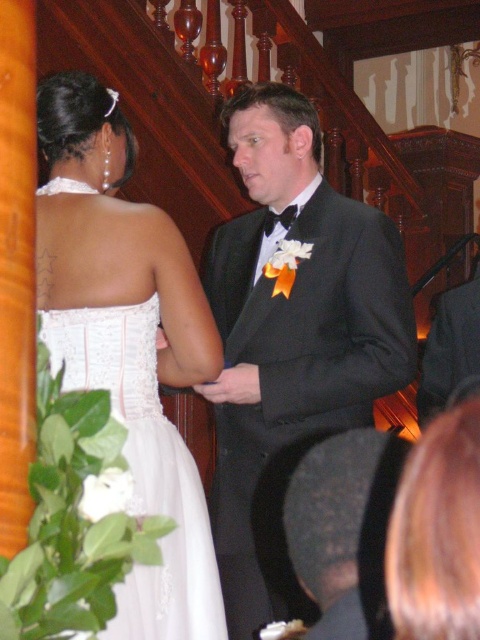
You are a photographer at a wedding. You need to capture a closeup shot of the black satin tuxedo at center and white satin dress at center. The camera you are using has a minimum focusing distance of 20 inches. Can you take the photo without moving either of the subjects?

The black satin tuxedo at center and white satin dress at center are 30.82 inches apart from each other. Since the camera has a minimum focusing distance of 20 inches, you can take the photo without moving the subjects as the distance between them is greater than the required minimum focusing distance.

You are standing in the formal event venue and want to move from the point at coordinates point (x=337, y=225) to the point at coordinates point (x=81, y=72). Which direction should you move to reach your destination?

To move from point (x=337, y=225) to point (x=81, y=72), you should move downward and to the left since point (x=337, y=225) is further towards the viewer compared to the other point.

You are a photographer at the event and need to position a spotlight exactly at the center of the black satin tuxedo at center. The coordinate system has the origin at the bottom left corner of the image. What are the coordinates where you should place the spotlight?

The coordinates for the center of the black satin tuxedo at center are at point (291, 339). Therefore, the spotlight should be placed at coordinates (291, 339).